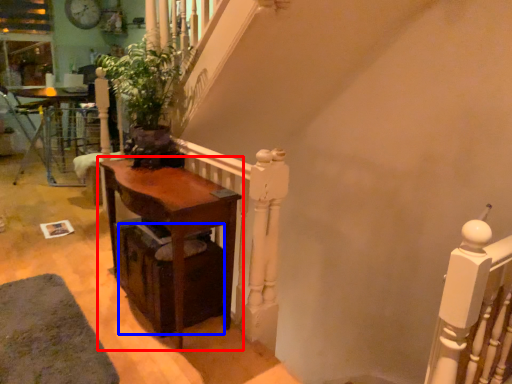
Question: Which of the following is the farthest to the observer, table (highlighted by a red box) or drawer (highlighted by a blue box)?

Choices:
 (A) table
 (B) drawer

Answer: (B)